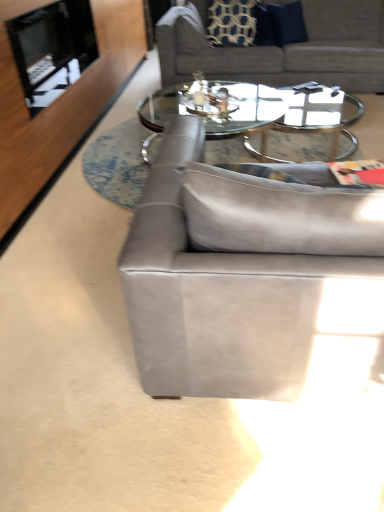
Question: Does suede gray couch at upper center, the 2th studio couch from the front, have a greater height compared to suede gray couch at center, the 1th studio couch viewed from the front?

Choices:
 (A) yes
 (B) no

Answer: (B)

Question: Is the surface of suede gray couch at upper center, arranged as the 2th studio couch when ordered from the bottom, in direct contact with suede gray couch at center, which appears as the 2th studio couch when viewed from the top?

Choices:
 (A) yes
 (B) no

Answer: (B)

Question: From the image's perspective, is suede gray couch at upper center, arranged as the 2th studio couch when ordered from the bottom, located beneath suede gray couch at center, the 1th studio couch viewed from the front?

Choices:
 (A) yes
 (B) no

Answer: (B)

Question: Can you confirm if suede gray couch at upper center, arranged as the 2th studio couch when ordered from the bottom, is smaller than suede gray couch at center, the 1th studio couch viewed from the front?

Choices:
 (A) no
 (B) yes

Answer: (A)

Question: Can you confirm if suede gray couch at upper center, which is the first studio couch in back-to-front order, is thinner than suede gray couch at center, the 1th studio couch viewed from the front?

Choices:
 (A) no
 (B) yes

Answer: (A)

Question: From a real-world perspective, is black glass fireplace at upper left above or below suede gray couch at upper center, the 2th studio couch from the front?

Choices:
 (A) below
 (B) above

Answer: (B)

Question: Looking at the image, does black glass fireplace at upper left seem bigger or smaller compared to suede gray couch at upper center, the 2th studio couch from the front?

Choices:
 (A) big
 (B) small

Answer: (B)

Question: Relative to suede gray couch at upper center, the 2th studio couch from the front, is black glass fireplace at upper left in front or behind?

Choices:
 (A) behind
 (B) front

Answer: (B)

Question: Is black glass fireplace at upper left to the left or to the right of suede gray couch at upper center, which is the first studio couch in back-to-front order, in the image?

Choices:
 (A) left
 (B) right

Answer: (A)

Question: From a real-world perspective, is clear glass coffee table at center physically located above or below black glass fireplace at upper left?

Choices:
 (A) above
 (B) below

Answer: (B)

Question: Would you say clear glass coffee table at center is to the left or to the right of black glass fireplace at upper left in the picture?

Choices:
 (A) right
 (B) left

Answer: (A)

Question: In terms of size, does clear glass coffee table at center appear bigger or smaller than black glass fireplace at upper left?

Choices:
 (A) small
 (B) big

Answer: (B)

Question: Considering their positions, is clear glass coffee table at center located in front of or behind black glass fireplace at upper left?

Choices:
 (A) front
 (B) behind

Answer: (B)

Question: Is point (321, 23) positioned closer to the camera than point (331, 158)?

Choices:
 (A) closer
 (B) farther

Answer: (B)

Question: Do you think suede gray couch at upper center, the 2th studio couch from the front, is within clear glass coffee table at center, or outside of it?

Choices:
 (A) inside
 (B) outside

Answer: (B)